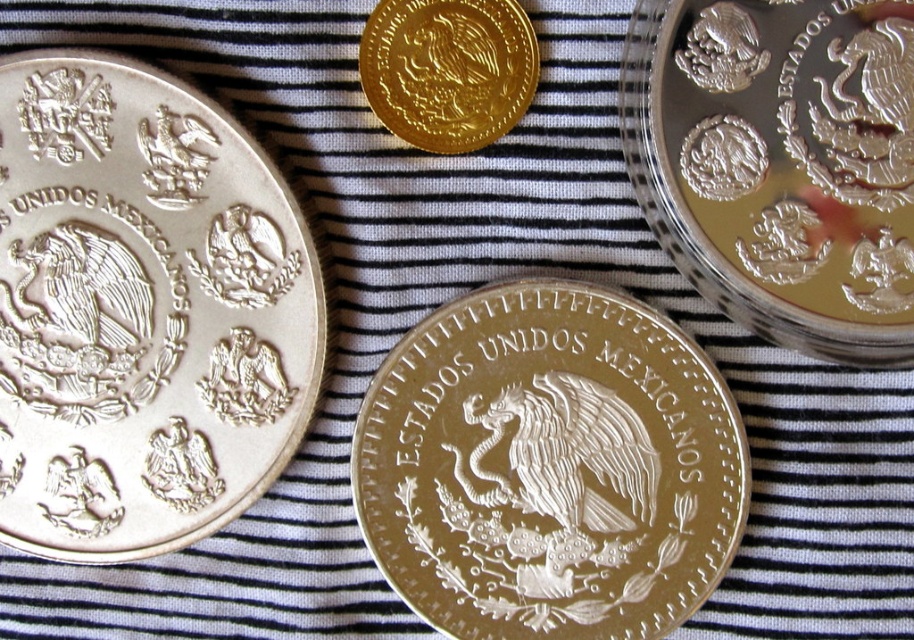
You are a photographer adjusting your camera focus. You notice two points in the image labeled as point 1 and point 2. Point 1 is at coordinates [27,182] and point 2 is at [509,58]. Which point should you focus on first if you want to ensure the closest object is in focus?

Point 1 at coordinates [27,182] is closer to the camera than point 2 at [509,58]. Therefore, you should focus on point 1 first to ensure the closest object is in focus.